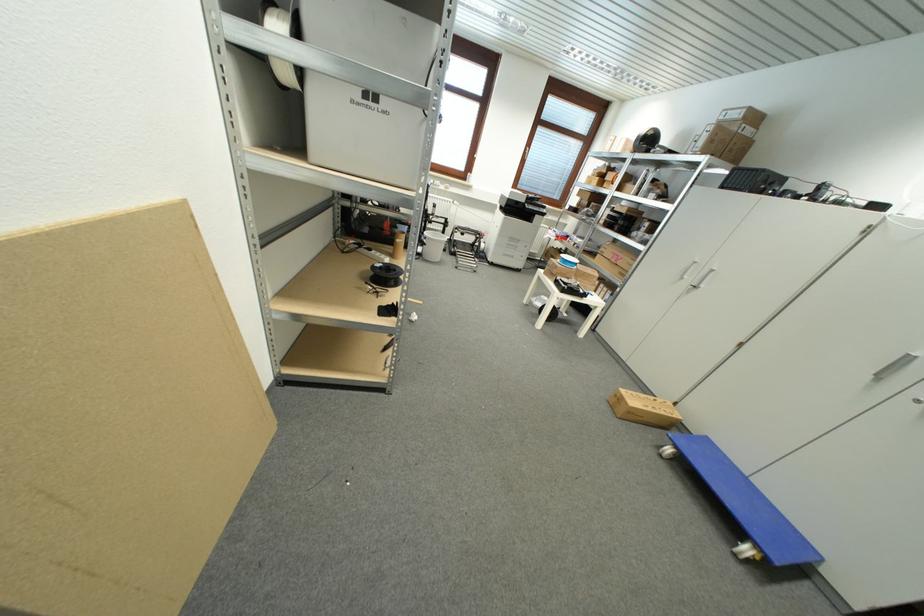
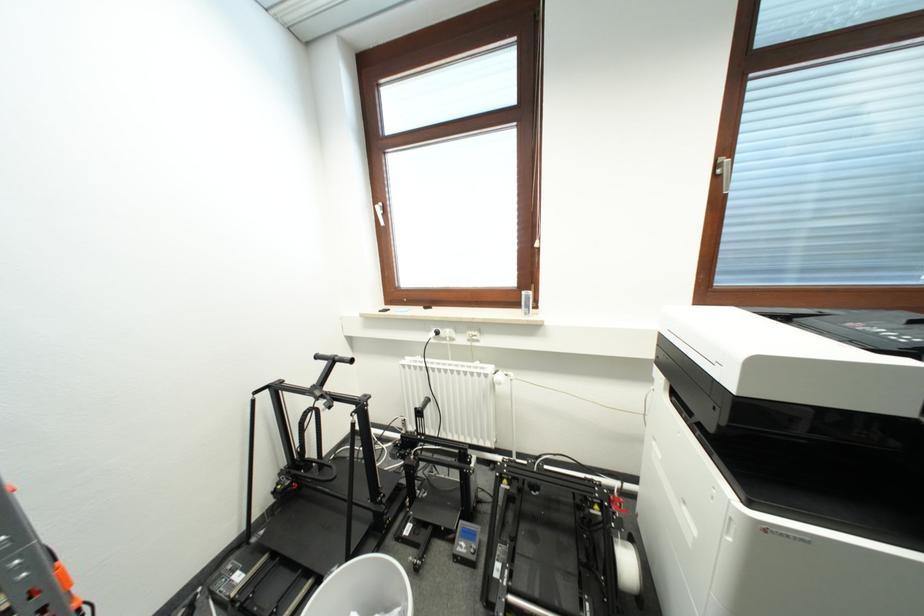
The point at (529,152) is marked in the first image. Where is the corresponding point in the second image?

(721, 169)